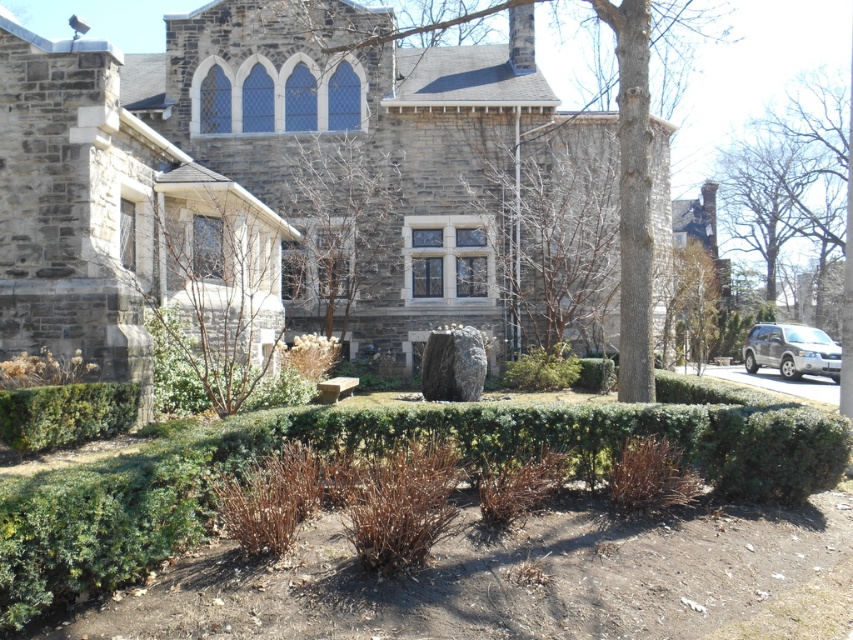
Looking at this image, you are standing in the garden in front of the stone building. You see the bare branches at center and the brown textured tree at center. Which one is closer to you?

The bare branches at center is closer to you because it is in front of the brown textured tree at center.

You are standing in front of the stone building and want to take a photo. You notice two points marked in the garden. The first point is at coordinate point (194, 362), and the second point is at coordinate point (83, 413). Which point is closer to your camera position?

Point (83, 413) is closer to the camera position because it is less further than point (194, 362).